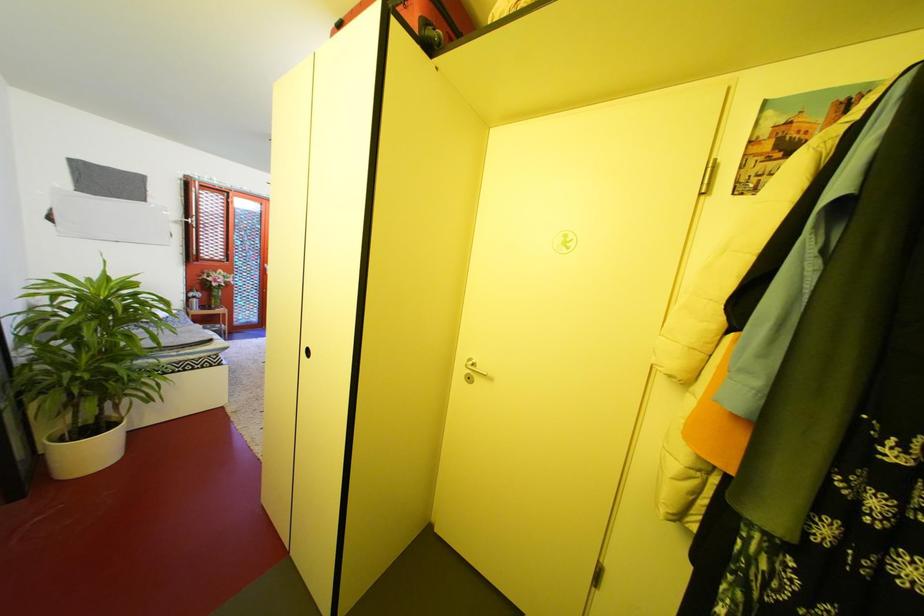
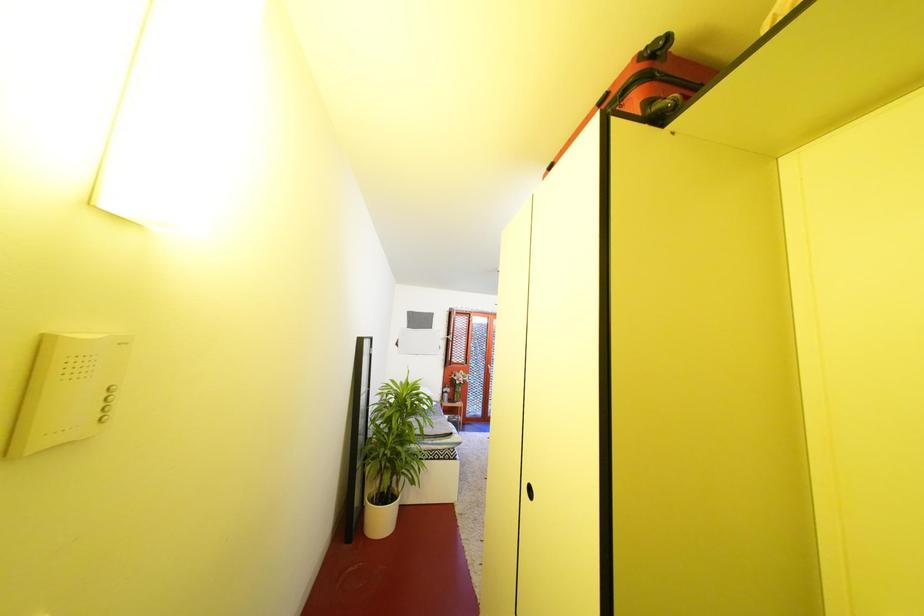
How did the camera likely rotate?

The camera rotated toward left-up.